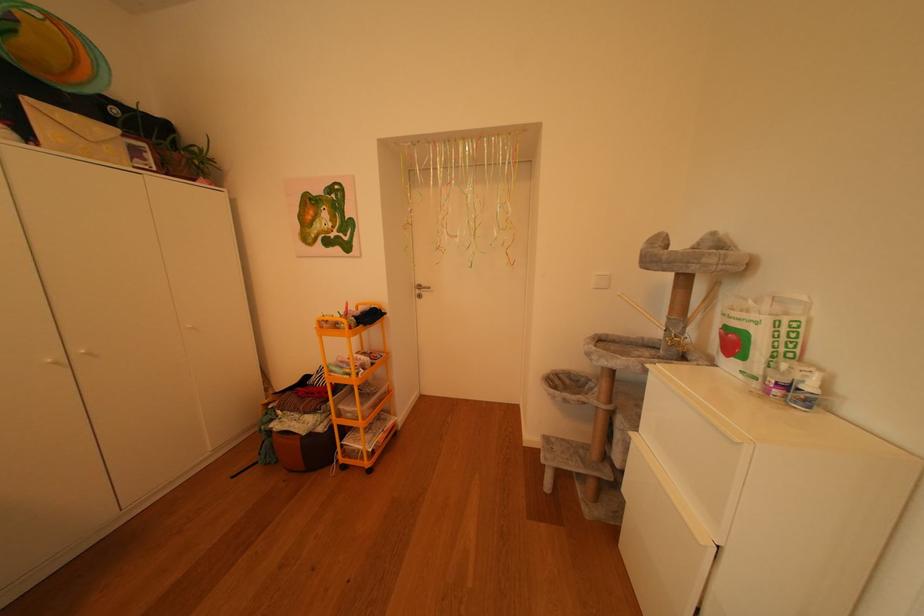
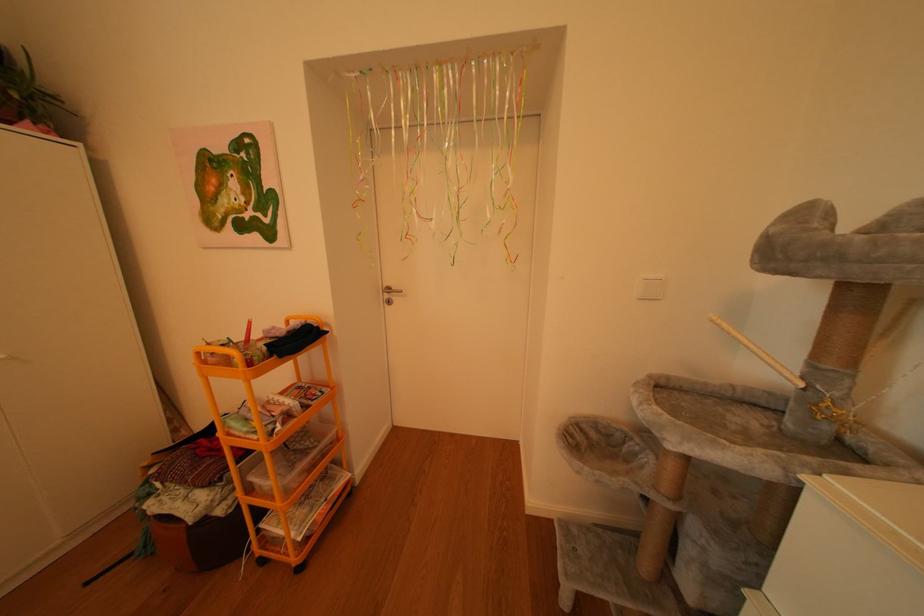
Question: The camera is either moving clockwise (left) or counter-clockwise (right) around the object. The first image is from the beginning of the video and the second image is from the end. Is the camera moving left or right when shooting the video?

Choices:
 (A) Left
 (B) Right

Answer: (A)